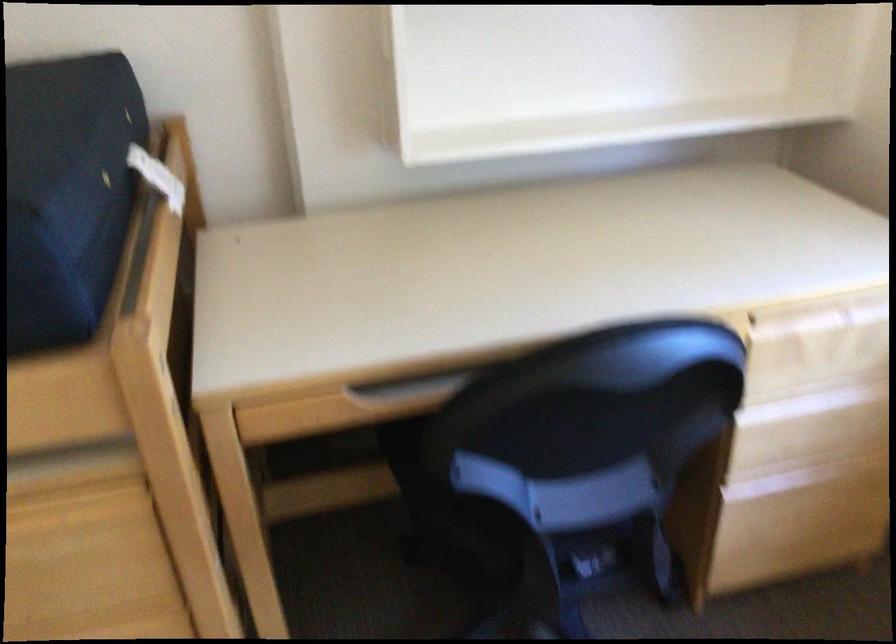
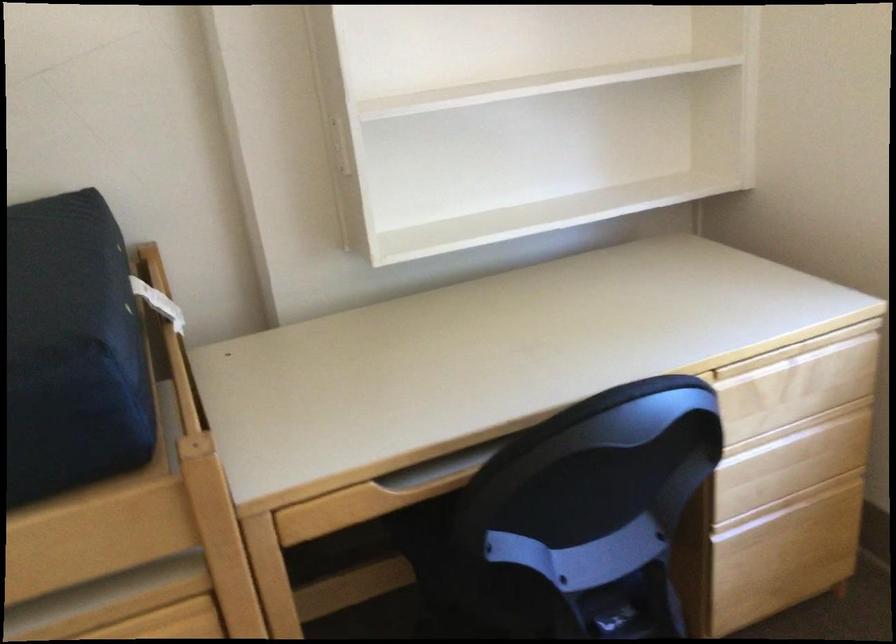
Locate, in the second image, the point that corresponds to (x=410, y=406) in the first image.

(431, 489)